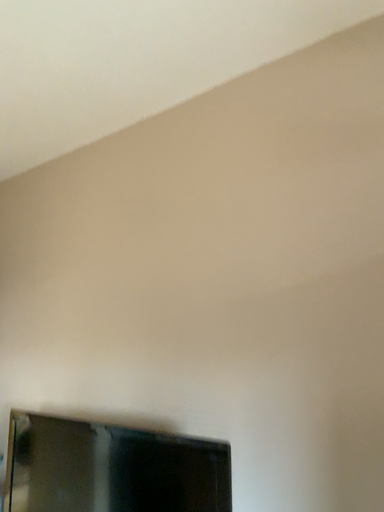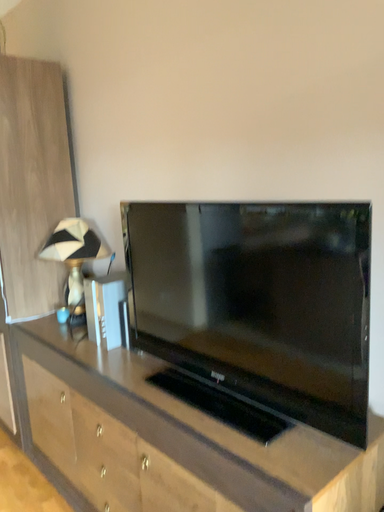
Question: How did the camera likely rotate when shooting the video?

Choices:
 (A) rotated left
 (B) rotated right

Answer: (A)